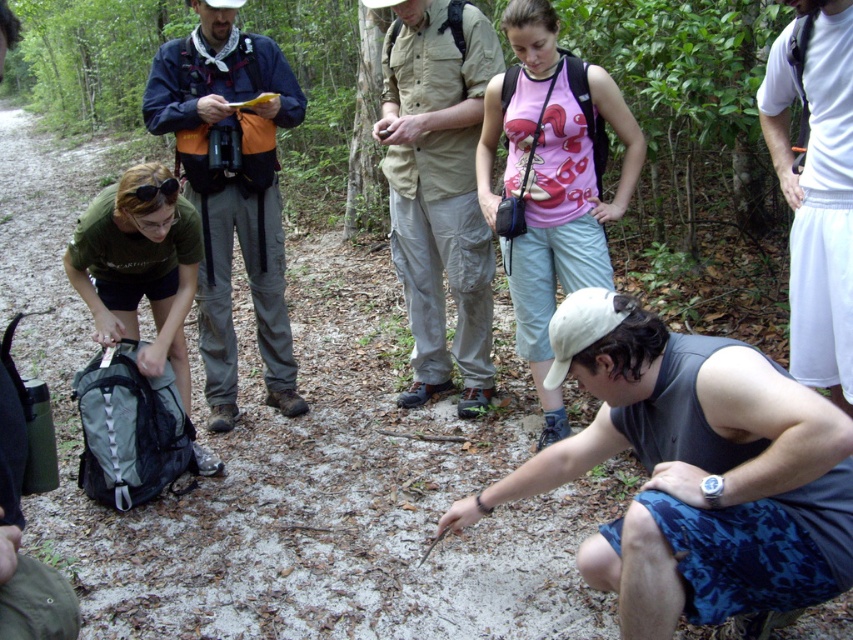
Question: Is dark blue jacket at center bigger than white cotton shirt at upper right?

Choices:
 (A) yes
 (B) no

Answer: (A)

Question: Is gray fabric shorts at lower right further to the viewer compared to pink cotton tank top at center?

Choices:
 (A) no
 (B) yes

Answer: (A)

Question: From the image, what is the correct spatial relationship of dark blue jacket at center in relation to pink cotton tank top at center?

Choices:
 (A) below
 (B) above

Answer: (B)

Question: Which of the following is the farthest from the observer?

Choices:
 (A) pink cotton tank top at center
 (B) khaki cotton shirt at center

Answer: (B)

Question: Which point appears closest to the camera in this image?

Choices:
 (A) (238, 208)
 (B) (590, 182)
 (C) (770, 52)
 (D) (102, 208)

Answer: (C)

Question: Which point is closer to the camera taking this photo?

Choices:
 (A) (612, 525)
 (B) (381, 93)

Answer: (A)